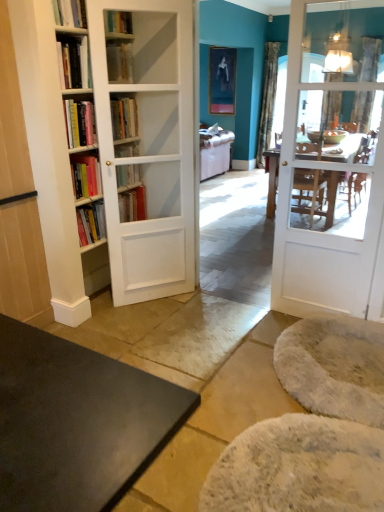
Locate an element on the screen. vacant area that is in front of white glossy bookcase at left is located at coordinates click(151, 323).